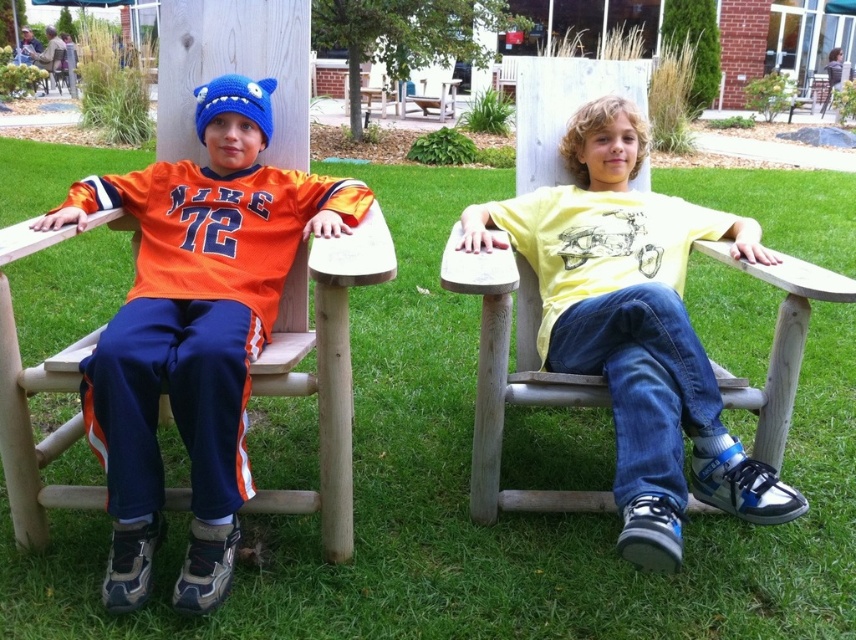
Question: Which object appears closest to the camera in this image?

Choices:
 (A) orange jersey at left
 (B) yellow matte shirt at center

Answer: (B)

Question: Where is yellow matte shirt at center located in relation to orange jersey at left in the image?

Choices:
 (A) above
 (B) below

Answer: (A)

Question: In this image, where is yellow matte shirt at center located relative to orange jersey at left?

Choices:
 (A) above
 (B) below

Answer: (A)

Question: Can you confirm if yellow matte shirt at center is positioned below orange jersey at left?

Choices:
 (A) no
 (B) yes

Answer: (A)

Question: Which object appears closest to the camera in this image?

Choices:
 (A) yellow matte shirt at center
 (B) orange jersey at left

Answer: (A)